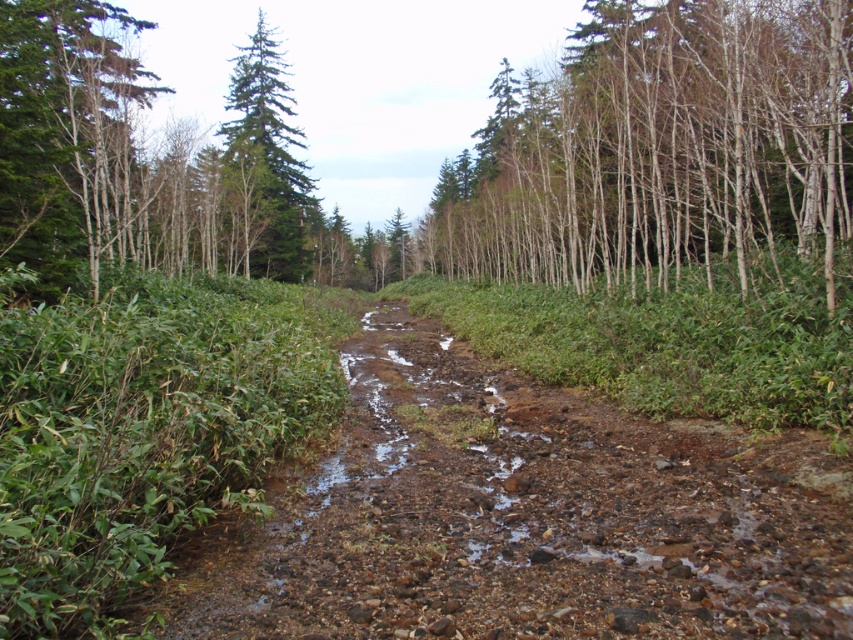
You are a hiker standing at the center of the path in the forest. You notice the bare wood trees at upper right. Based on their 2D location, which direction should you walk to reach them?

The bare wood trees at upper right are located at point 0.233 on the x axis and 0.774 on the y axis. Since the upper right corner of the image is the highest point on both axes, the trees are positioned to the upper right. To reach them, you should walk in the upper right direction from your current position at the center of the path.